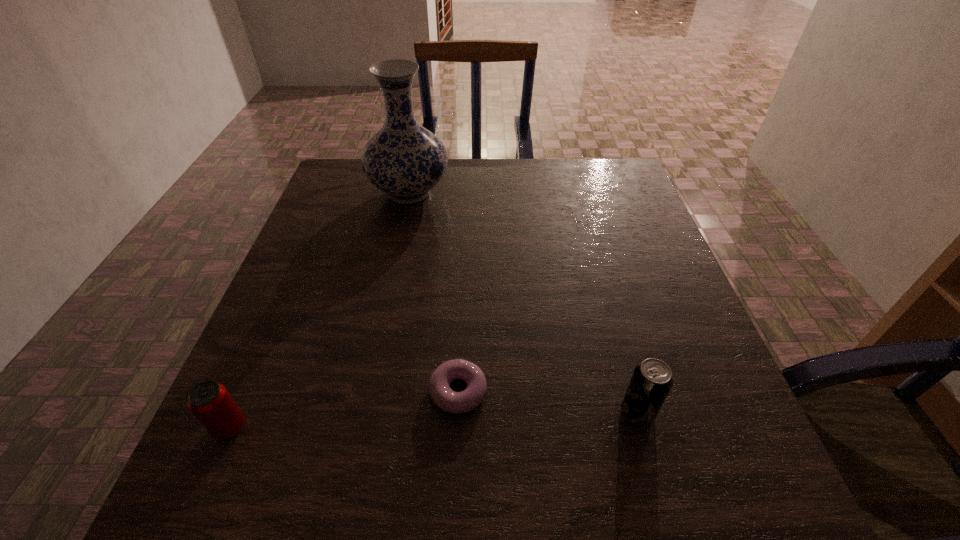
This screenshot has width=960, height=540. I want to click on the farthest object, so click(x=404, y=160).

The width and height of the screenshot is (960, 540). What are the coordinates of `the tallest object` in the screenshot? It's located at (404, 160).

The image size is (960, 540). I want to click on the rightmost object, so click(x=651, y=381).

Where is `can`? This screenshot has width=960, height=540. can is located at coordinates (210, 402).

You are a GUI agent. You are given a task and a screenshot of the screen. Output one action in this format:
    pyautogui.click(x=<x>, y=<y>)
    Task: Click on the leftmost object
    The image size is (960, 540).
    Given the screenshot: What is the action you would take?
    pyautogui.click(x=210, y=402)

Image resolution: width=960 pixels, height=540 pixels. Find the location of `doughnut`. doughnut is located at coordinates (452, 402).

Find the location of a particular element. free location located on the right of the farthest object is located at coordinates (588, 193).

The width and height of the screenshot is (960, 540). I want to click on free region located 0.300m on the left of the soda can, so click(x=446, y=412).

Find the location of a particular element. The width and height of the screenshot is (960, 540). free spot located 0.130m on the right of the leftmost object is located at coordinates (324, 427).

Identify the location of free space located 0.320m on the back of the shortest object. Image resolution: width=960 pixels, height=540 pixels. (464, 255).